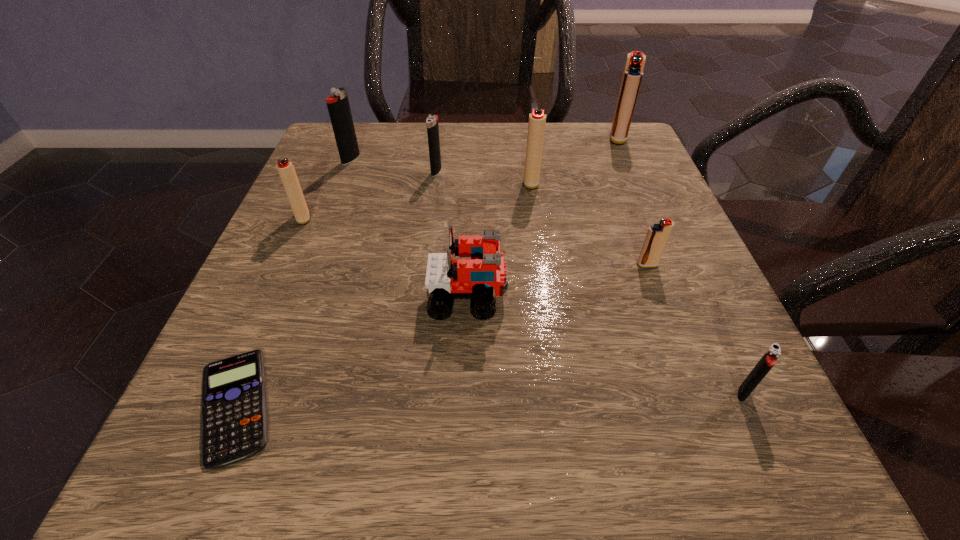
Where is `vacant position located on the front of the biggest black igniter`? Image resolution: width=960 pixels, height=540 pixels. vacant position located on the front of the biggest black igniter is located at coordinates pos(334,203).

The height and width of the screenshot is (540, 960). Identify the location of vacant region located 0.130m on the front of the third igniter from left to right. (431, 218).

Identify the location of free spot located on the back of the leftmost red igniter. This screenshot has width=960, height=540. coord(329,158).

Locate an element on the screen. The width and height of the screenshot is (960, 540). vacant space located 0.060m on the front-facing side of the red Lego is located at coordinates (546, 296).

What are the coordinates of `free location located on the left of the smallest red igniter` in the screenshot? It's located at (413, 265).

Identify the location of free space located on the left of the nearest black igniter. The width and height of the screenshot is (960, 540). (662, 393).

Locate an element on the screen. vacant area situated on the back of the shortest object is located at coordinates (290, 272).

This screenshot has width=960, height=540. What are the coordinates of `object at the near edge` in the screenshot? It's located at (234, 420).

Where is `calculator present at the left edge`? Image resolution: width=960 pixels, height=540 pixels. calculator present at the left edge is located at coordinates (234, 420).

Find the location of a particular element. object situated at the far left corner is located at coordinates (338, 105).